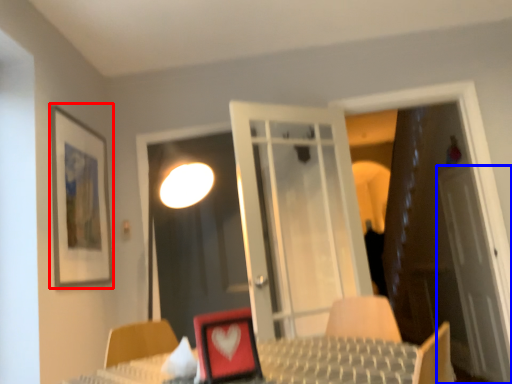
Question: Which point is further to the camera, picture frame (highlighted by a red box) or screen door (highlighted by a blue box)?

Choices:
 (A) picture frame
 (B) screen door

Answer: (B)